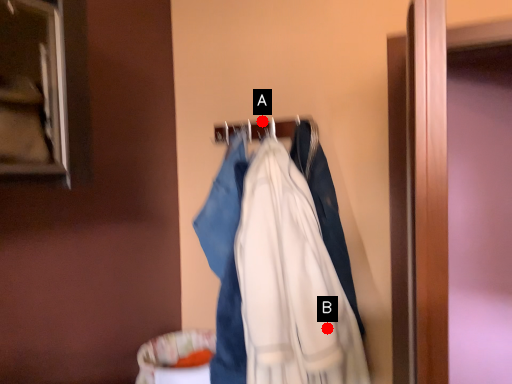
Question: Two points are circled on the image, labeled by A and B beside each circle. Which point is further to the camera?

Choices:
 (A) A is further
 (B) B is further

Answer: (A)